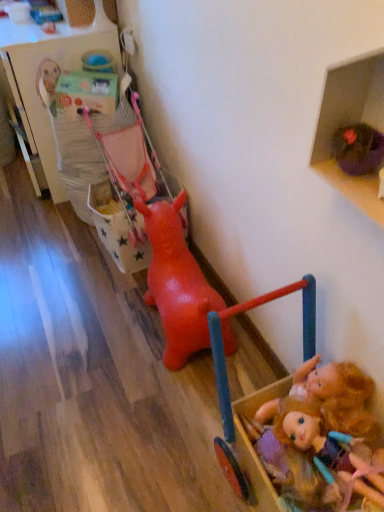
This screenshot has height=512, width=384. I want to click on vacant area on top of rubber pink baby carriage at center-left (from a real-world perspective), so click(145, 187).